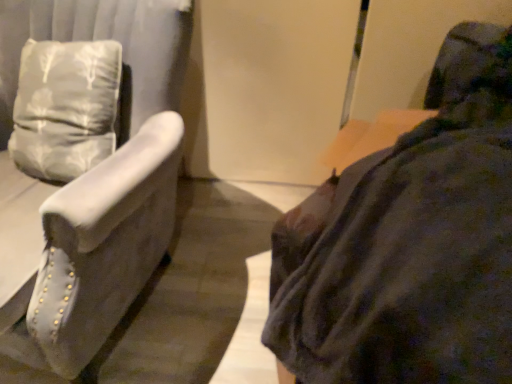
Question: Considering the relative positions of suede-like gray armchair at left, arranged as the first furniture when viewed from the left, and dark fabric couch at right, the 1th furniture positioned from the right, in the image provided, is suede-like gray armchair at left, arranged as the first furniture when viewed from the left, to the right of dark fabric couch at right, the 1th furniture positioned from the right, from the viewer's perspective?

Choices:
 (A) yes
 (B) no

Answer: (B)

Question: Is suede-like gray armchair at left, arranged as the 2th furniture when viewed from the right, outside dark fabric couch at right, the 1th furniture positioned from the right?

Choices:
 (A) no
 (B) yes

Answer: (B)

Question: Is suede-like gray armchair at left, arranged as the 2th furniture when viewed from the right, smaller than dark fabric couch at right, the 1th furniture positioned from the right?

Choices:
 (A) yes
 (B) no

Answer: (B)

Question: From the image's perspective, would you say suede-like gray armchair at left, arranged as the 2th furniture when viewed from the right, is positioned over dark fabric couch at right, the 1th furniture positioned from the right?

Choices:
 (A) no
 (B) yes

Answer: (B)

Question: From a real-world perspective, is suede-like gray armchair at left, arranged as the 2th furniture when viewed from the right, located higher than dark fabric couch at right, the 1th furniture positioned from the right?

Choices:
 (A) yes
 (B) no

Answer: (B)

Question: Does suede-like gray armchair at left, arranged as the first furniture when viewed from the left, turn towards dark fabric couch at right, the 1th furniture positioned from the right?

Choices:
 (A) yes
 (B) no

Answer: (B)

Question: From a real-world perspective, is dark fabric couch at right, the second furniture when ordered from left to right, on top of suede-like gray armchair at left, arranged as the first furniture when viewed from the left?

Choices:
 (A) yes
 (B) no

Answer: (A)

Question: Can you confirm if dark fabric couch at right, the 1th furniture positioned from the right, is shorter than suede-like gray armchair at left, arranged as the 2th furniture when viewed from the right?

Choices:
 (A) no
 (B) yes

Answer: (B)

Question: Is dark fabric couch at right, the 1th furniture positioned from the right, beside suede-like gray armchair at left, arranged as the 2th furniture when viewed from the right?

Choices:
 (A) no
 (B) yes

Answer: (A)

Question: Could you tell me if dark fabric couch at right, the second furniture when ordered from left to right, is facing suede-like gray armchair at left, arranged as the first furniture when viewed from the left?

Choices:
 (A) no
 (B) yes

Answer: (A)

Question: Is dark fabric couch at right, the second furniture when ordered from left to right, thinner than suede-like gray armchair at left, arranged as the first furniture when viewed from the left?

Choices:
 (A) yes
 (B) no

Answer: (B)

Question: Is suede-like gray armchair at left, arranged as the first furniture when viewed from the left, inside dark fabric couch at right, the second furniture when ordered from left to right?

Choices:
 (A) no
 (B) yes

Answer: (A)

Question: From a real-world perspective, is suede-like gray armchair at left, arranged as the 2th furniture when viewed from the right, positioned above or below dark fabric couch at right, the 1th furniture positioned from the right?

Choices:
 (A) below
 (B) above

Answer: (A)